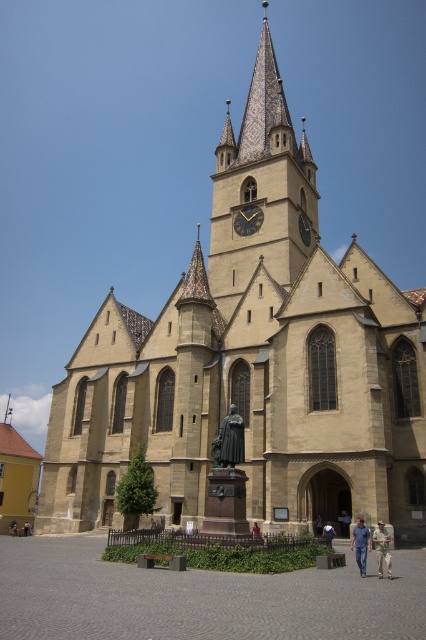
What do you see at coordinates (382, 548) in the screenshot?
I see `camouflage fabric jacket at lower right` at bounding box center [382, 548].

Between point (377, 529) and point (256, 525), which one is positioned behind?

The point (256, 525) is more distant.

Identify the location of camouflage fabric jacket at lower right. This screenshot has width=426, height=640. (382, 548).

What do you see at coordinates (256, 531) in the screenshot? The image size is (426, 640). I see `brown wooden statue at center` at bounding box center [256, 531].

Can you confirm if brown wooden statue at center is positioned to the left of dark brown wooden statue at center?

In fact, brown wooden statue at center is to the right of dark brown wooden statue at center.

At what (x,y) coordinates should I click in order to perform the action: click on brown wooden statue at center. Please return your answer as a coordinate pair (x, y). This screenshot has height=640, width=426. Looking at the image, I should click on (256, 531).

Can you confirm if gold metallic clock at center is positioned above light blue fabric shirt at lower center?

Yes, gold metallic clock at center is above light blue fabric shirt at lower center.

Between point (238, 212) and point (331, 532), which one is positioned behind?

The point (238, 212) is behind.

Which is behind, point (252, 209) or point (325, 532)?

Point (252, 209)

Locate an element on the screen. gold metallic clock at center is located at coordinates (247, 220).